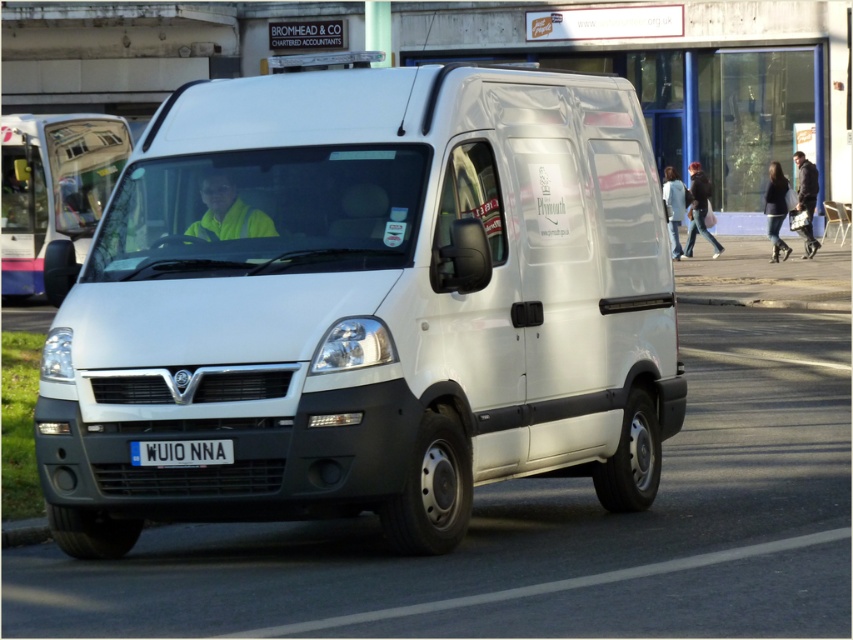
Question: Is white matte van at center bigger than matte white van at center?

Choices:
 (A) yes
 (B) no

Answer: (A)

Question: Which object is closer to the camera taking this photo?

Choices:
 (A) white plastic license plate at center
 (B) matte white van at center

Answer: (A)

Question: Can you confirm if white matte van at center is wider than matte white van at center?

Choices:
 (A) yes
 (B) no

Answer: (A)

Question: Which point appears closest to the camera in this image?

Choices:
 (A) (102, 140)
 (B) (167, 99)

Answer: (A)

Question: Which is nearer to the matte white van at center?

Choices:
 (A) white matte van at center
 (B) white plastic license plate at center

Answer: (A)

Question: Can you confirm if white matte van at center is positioned to the right of white plastic license plate at center?

Choices:
 (A) no
 (B) yes

Answer: (B)